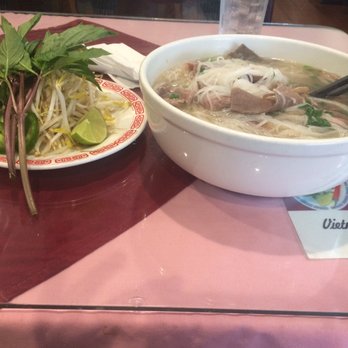
At what (x,y) coordinates should I click in order to perform the action: click on plate. Please return your answer as a coordinate pair (x, y). Looking at the image, I should click on (97, 152).